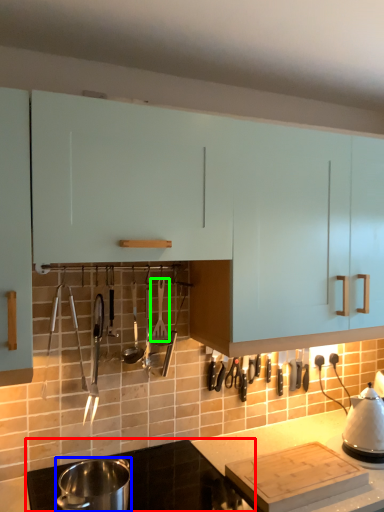
Question: Estimate the real-world distances between objects in this image. Which object is closer to countertop (highlighted by a red box), kitchen appliance (highlighted by a blue box) or silverware (highlighted by a green box)?

Choices:
 (A) kitchen appliance
 (B) silverware

Answer: (A)